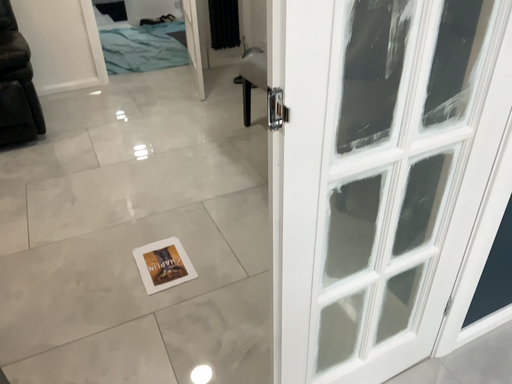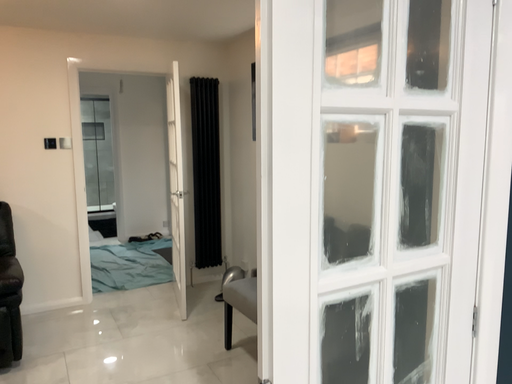
Question: How did the camera likely rotate when shooting the video?

Choices:
 (A) rotated downward
 (B) rotated upward

Answer: (B)